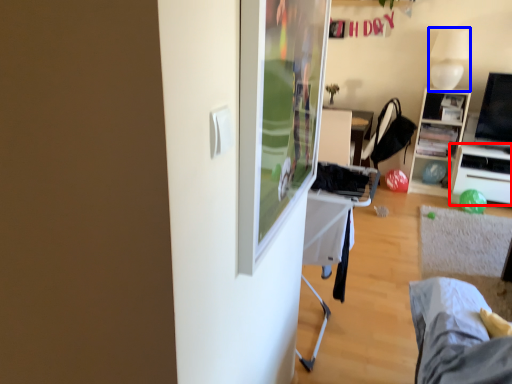
Question: Which point is closer to the camera, desk (highlighted by a red box) or lamp (highlighted by a blue box)?

Choices:
 (A) desk
 (B) lamp

Answer: (B)